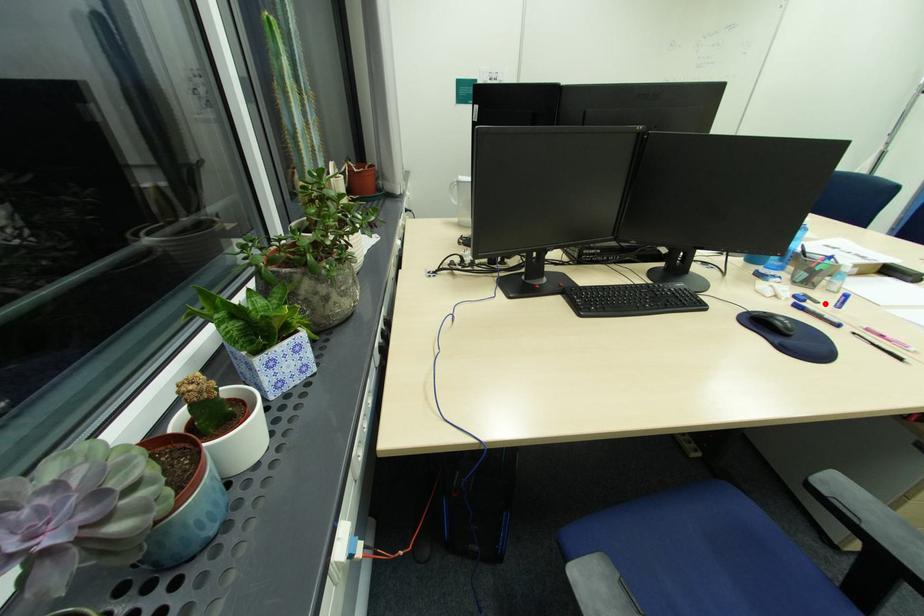
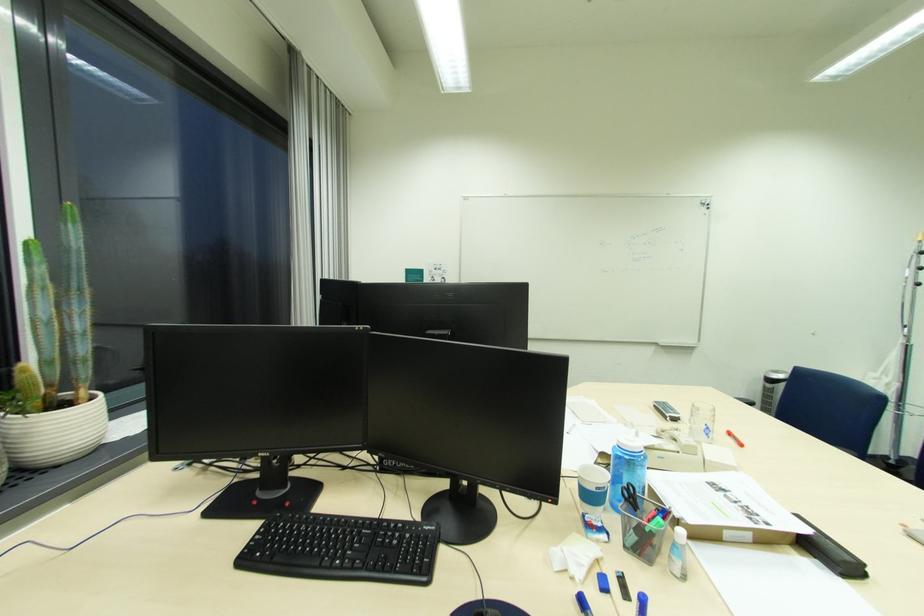
The point at the highlighted location is marked in the first image. Where is the corresponding point in the second image?

(636, 601)